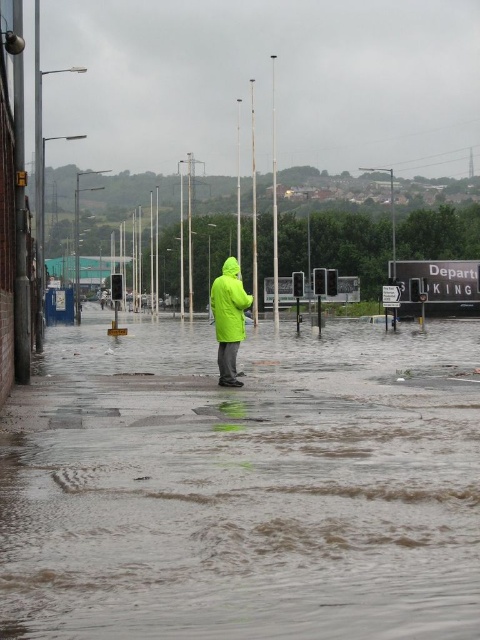
Does brown muddy water at center have a larger size compared to bright green waterproof jacket at center?

Correct, brown muddy water at center is larger in size than bright green waterproof jacket at center.

Does brown muddy water at center have a greater width compared to bright green waterproof jacket at center?

Yes.

Which is behind, point (33, 561) or point (223, 296)?

Point (223, 296)

The image size is (480, 640). In order to click on brown muddy water at center in this screenshot , I will do `click(243, 484)`.